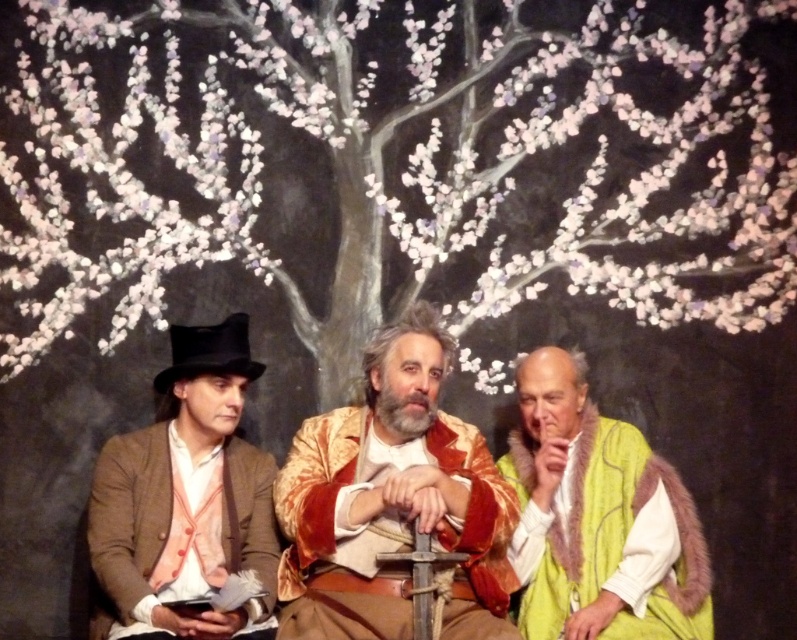
Which is behind, point (289, 481) or point (646, 488)?

Positioned behind is point (646, 488).

Is point (387, 362) less distant than point (540, 376)?

Yes.

Where is `velvet gold jacket at center`? This screenshot has height=640, width=797. velvet gold jacket at center is located at coordinates pyautogui.click(x=391, y=500).

Does matte brown coat at left have a greater height compared to green fur vest at right?

Yes.

Is matte brown coat at left shorter than green fur vest at right?

Incorrect, matte brown coat at left's height does not fall short of green fur vest at right's.

Locate an element on the screen. This screenshot has width=797, height=640. matte brown coat at left is located at coordinates (185, 499).

At what (x,y) coordinates should I click in order to perform the action: click on matte brown coat at left. Please return your answer as a coordinate pair (x, y). The height and width of the screenshot is (640, 797). Looking at the image, I should click on (185, 499).

Who is taller, white textured tree at center or green fur vest at right?

With more height is white textured tree at center.

Which is in front, point (179, 22) or point (564, 380)?

Point (564, 380) is in front.

The height and width of the screenshot is (640, 797). I want to click on white textured tree at center, so click(x=395, y=164).